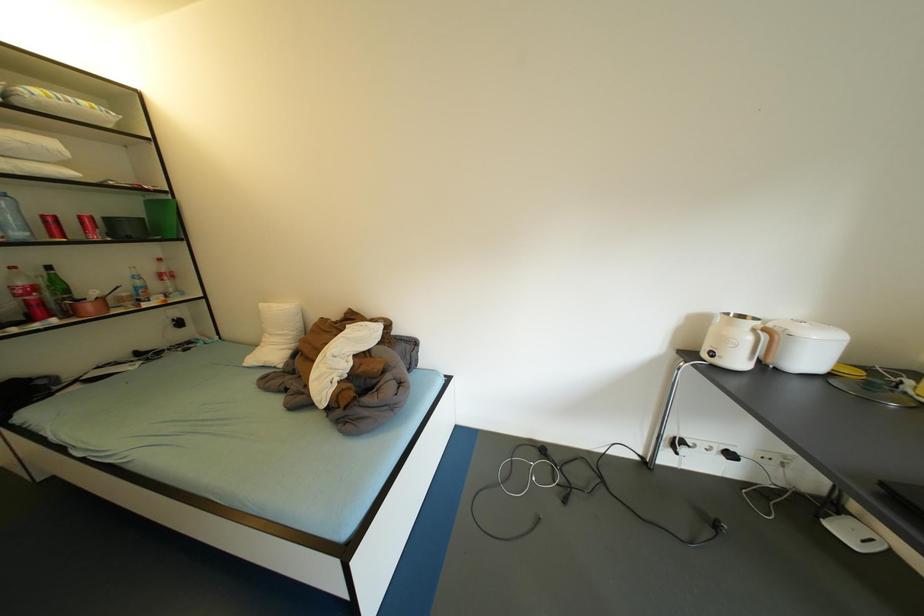
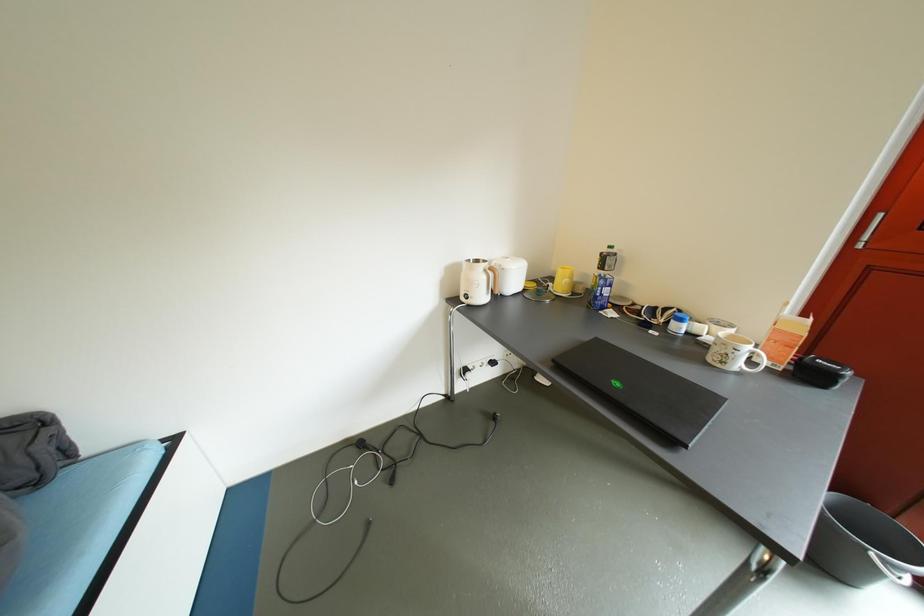
Question: The images are taken continuously from a first-person perspective. In which direction is your viewpoint rotating?

Choices:
 (A) Left
 (B) Right
 (C) Up
 (D) Down

Answer: (B)